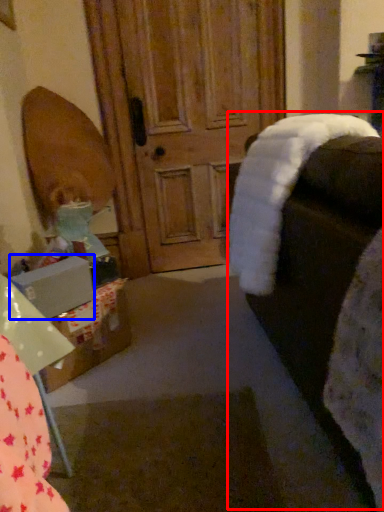
Question: Which object is further to the camera taking this photo, rocking chair (highlighted by a red box) or box (highlighted by a blue box)?

Choices:
 (A) rocking chair
 (B) box

Answer: (B)